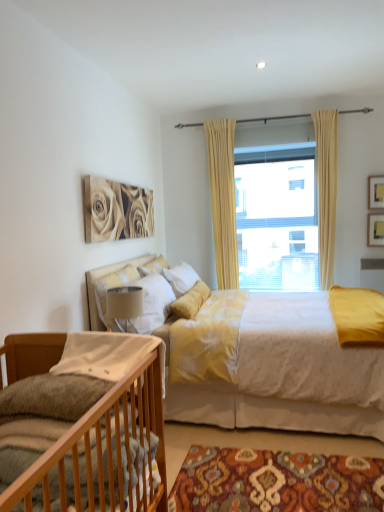
Question: From a real-world perspective, is velvet yellow bed at center, which is counted as the 2th bed, starting from the front, beneath beige fabric curtain at upper center, acting as the 2th curtain starting from the left?

Choices:
 (A) no
 (B) yes

Answer: (B)

Question: Considering the relative positions of velvet yellow bed at center, which is counted as the 2th bed, starting from the front, and beige fabric curtain at upper center, acting as the 2th curtain starting from the left, in the image provided, is velvet yellow bed at center, which is counted as the 2th bed, starting from the front, in front of beige fabric curtain at upper center, acting as the 2th curtain starting from the left,?

Choices:
 (A) yes
 (B) no

Answer: (A)

Question: Can you confirm if velvet yellow bed at center, which is counted as the 2th bed, starting from the front, is smaller than beige fabric curtain at upper center, acting as the 2th curtain starting from the left?

Choices:
 (A) no
 (B) yes

Answer: (A)

Question: Can you confirm if velvet yellow bed at center, which is the first bed in back-to-front order, is positioned to the left of beige fabric curtain at upper center, acting as the 2th curtain starting from the left?

Choices:
 (A) yes
 (B) no

Answer: (A)

Question: Is velvet yellow bed at center, which is counted as the 2th bed, starting from the front, not inside beige fabric curtain at upper center, acting as the 2th curtain starting from the left?

Choices:
 (A) no
 (B) yes

Answer: (B)

Question: Does velvet yellow bed at center, which is counted as the 2th bed, starting from the front, have a greater height compared to beige fabric curtain at upper center, the 1th curtain viewed from the right?

Choices:
 (A) no
 (B) yes

Answer: (A)

Question: Is patterned carpet at lower center oriented away from wooden picture frame at upper right, arranged as the 1th picture frame when viewed from the top?

Choices:
 (A) yes
 (B) no

Answer: (B)

Question: Does patterned carpet at lower center have a greater width compared to wooden picture frame at upper right, which is the second picture frame in bottom-to-top order?

Choices:
 (A) yes
 (B) no

Answer: (A)

Question: Can you confirm if patterned carpet at lower center is taller than wooden picture frame at upper right, arranged as the 1th picture frame when viewed from the top?

Choices:
 (A) no
 (B) yes

Answer: (A)

Question: Is patterned carpet at lower center at the right side of wooden picture frame at upper right, which is the second picture frame in bottom-to-top order?

Choices:
 (A) no
 (B) yes

Answer: (A)

Question: From the image's perspective, is patterned carpet at lower center below wooden picture frame at upper right, which is the second picture frame in bottom-to-top order?

Choices:
 (A) no
 (B) yes

Answer: (B)

Question: Is patterned carpet at lower center not within wooden picture frame at upper right, which is the second picture frame in bottom-to-top order?

Choices:
 (A) no
 (B) yes

Answer: (B)

Question: Can you confirm if yellow fabric curtain at center, which appears as the 1th curtain when viewed from the left, is positioned to the left of beige fabric curtain at upper center, acting as the 2th curtain starting from the left?

Choices:
 (A) yes
 (B) no

Answer: (A)